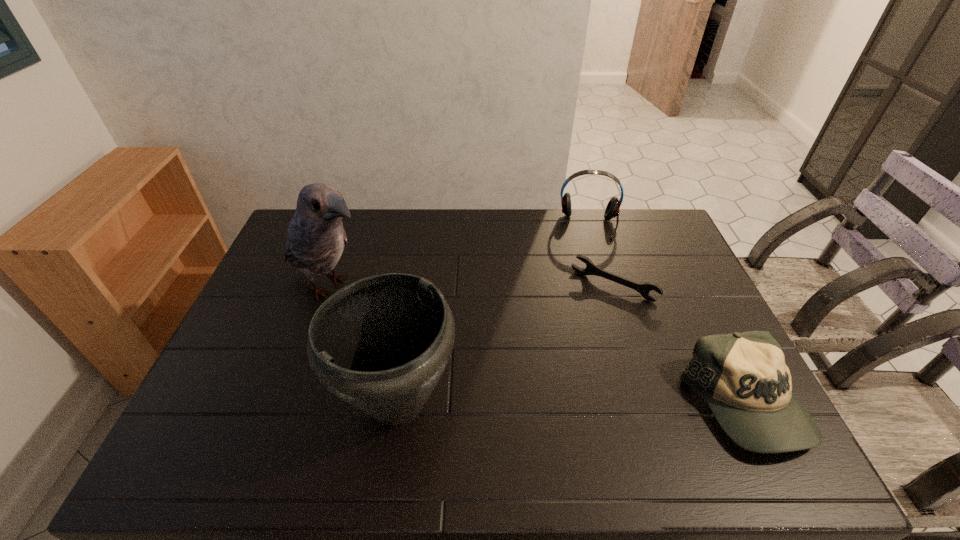
The width and height of the screenshot is (960, 540). I want to click on free spot located 0.150m with the microphone attached to the side of the farthest object, so click(589, 268).

Where is `blank area located 0.210m with the microphone attached to the side of the farthest object`? This screenshot has height=540, width=960. blank area located 0.210m with the microphone attached to the side of the farthest object is located at coordinates (590, 280).

Identify the location of free region located 0.130m with the microphone attached to the side of the farthest object. Image resolution: width=960 pixels, height=540 pixels. coord(589,264).

This screenshot has width=960, height=540. In order to click on free spot located on the open ends of the wrench in this screenshot , I will do `click(586, 319)`.

Locate an element on the screen. vacant space situated 0.080m on the open ends of the wrench is located at coordinates (586, 319).

This screenshot has height=540, width=960. Identify the location of free space located on the open ends of the wrench. (542, 388).

Locate an element on the screen. Image resolution: width=960 pixels, height=540 pixels. object present at the far edge is located at coordinates (612, 210).

This screenshot has width=960, height=540. I want to click on urn situated at the near edge, so click(381, 344).

Where is `baseball cap that is positioned at the near edge`? This screenshot has width=960, height=540. baseball cap that is positioned at the near edge is located at coordinates point(743,377).

The width and height of the screenshot is (960, 540). Identify the location of object that is at the left edge. (316, 237).